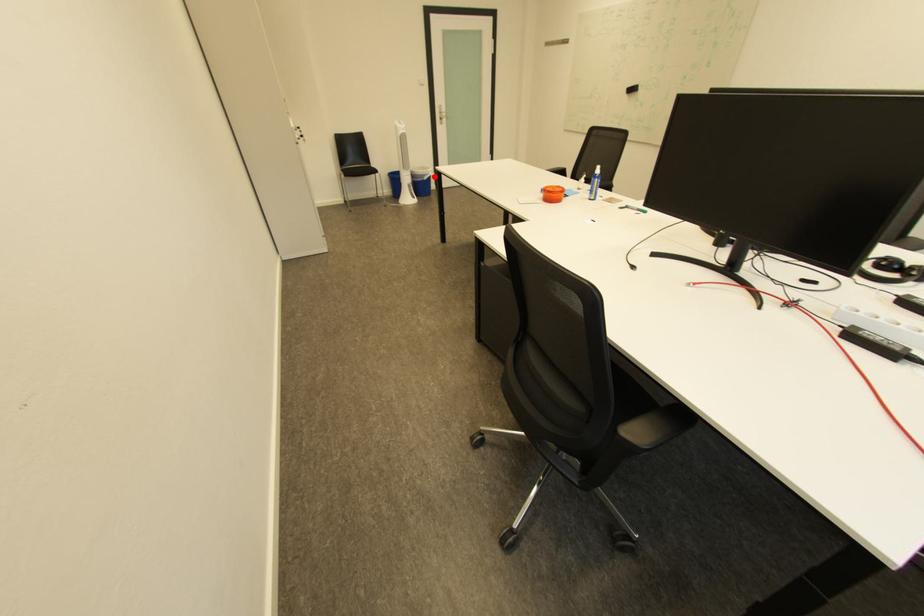
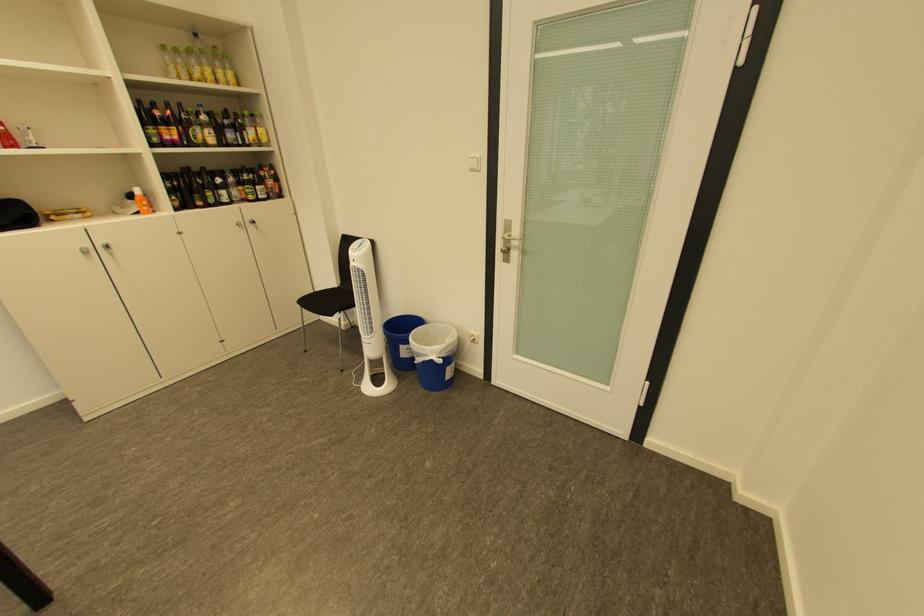
Question: I am providing you with two images of the same scene from different viewpoints. A red point is marked on the first image. At the location where the point appears in image 1, is it still visible in image 2?

Choices:
 (A) Yes
 (B) No

Answer: (A)